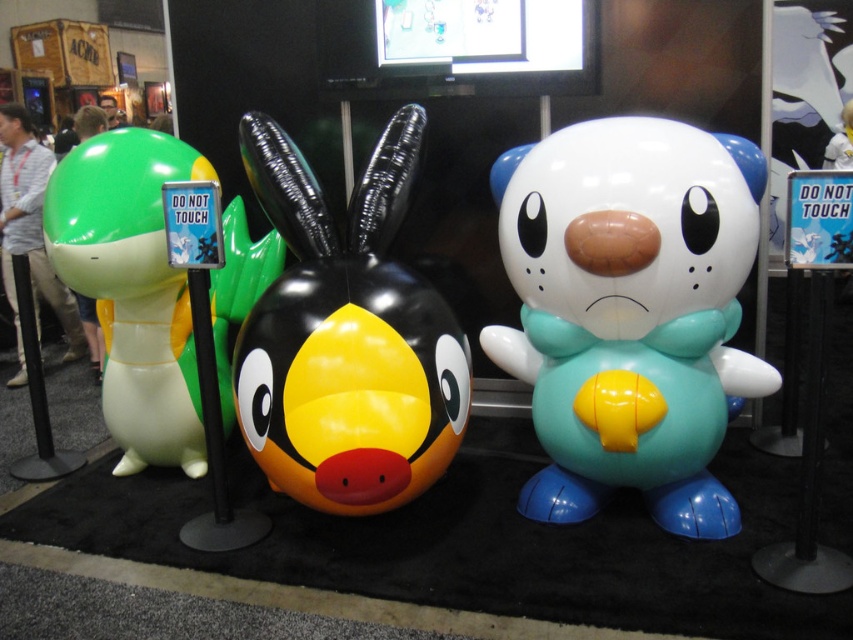
Is glossy rubber duck at center bigger than green rubber turtle at left?

No, glossy rubber duck at center is not bigger than green rubber turtle at left.

Who is more forward, (320, 349) or (112, 154)?

Point (320, 349)

Which is behind, point (287, 269) or point (186, 308)?

The point (186, 308) is behind.

I want to click on glossy rubber duck at center, so click(347, 337).

Which is more to the right, teal rubber plush at center or glossy rubber duck at center?

A: teal rubber plush at center is more to the right.

In the scene shown: Is teal rubber plush at center thinner than glossy rubber duck at center?

No, teal rubber plush at center is not thinner than glossy rubber duck at center.

You are a GUI agent. You are given a task and a screenshot of the screen. Output one action in this format:
    pyautogui.click(x=<x>, y=<y>)
    Task: Click on the teal rubber plush at center
    
    Given the screenshot: What is the action you would take?
    pyautogui.click(x=630, y=310)

This screenshot has height=640, width=853. Describe the element at coordinates (630, 310) in the screenshot. I see `teal rubber plush at center` at that location.

Does point (604, 368) come farther from viewer compared to point (233, 412)?

No, it is not.

At what (x,y) coordinates should I click in order to perform the action: click on teal rubber plush at center. Please return your answer as a coordinate pair (x, y). This screenshot has width=853, height=640. Looking at the image, I should click on (630, 310).

Identify the location of teal rubber plush at center. (630, 310).